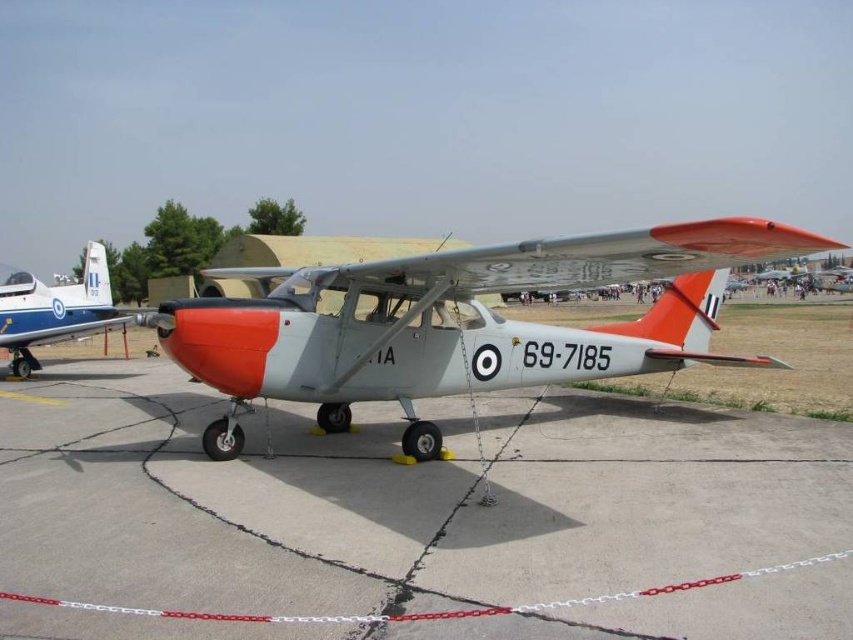
Question: Does gray concrete tarmac at center have a larger size compared to matte blue airplane at left?

Choices:
 (A) yes
 (B) no

Answer: (B)

Question: Does matte gray airplane at center have a lesser width compared to matte blue airplane at left?

Choices:
 (A) no
 (B) yes

Answer: (A)

Question: Which point is closer to the camera?

Choices:
 (A) gray concrete tarmac at center
 (B) matte blue airplane at left

Answer: (A)

Question: Is gray concrete tarmac at center to the right of matte gray airplane at center from the viewer's perspective?

Choices:
 (A) no
 (B) yes

Answer: (B)

Question: Considering the real-world distances, which object is farthest from the matte blue airplane at left?

Choices:
 (A) matte gray airplane at center
 (B) gray concrete tarmac at center

Answer: (B)

Question: Estimate the real-world distances between objects in this image. Which object is closer to the matte gray airplane at center?

Choices:
 (A) matte blue airplane at left
 (B) gray concrete tarmac at center

Answer: (B)